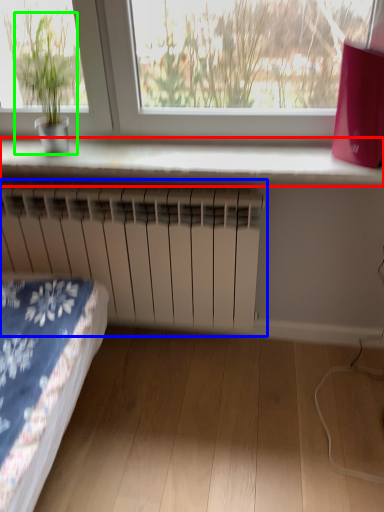
Question: Based on their relative distances, which object is nearer to window sill (highlighted by a red box)? Choose from radiator (highlighted by a blue box) and houseplant (highlighted by a green box).

Choices:
 (A) radiator
 (B) houseplant

Answer: (A)